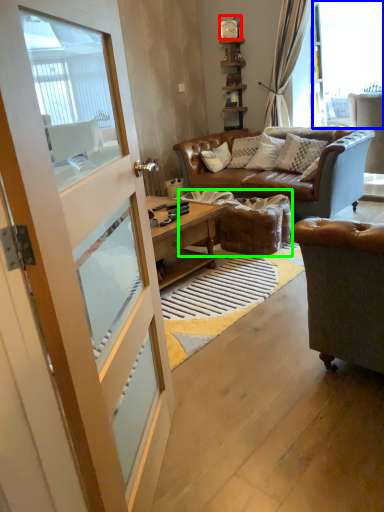
Question: Which object is positioned closest to clock (highlighted by a red box)? Select from window (highlighted by a blue box) and footrest (highlighted by a green box).

Choices:
 (A) window
 (B) footrest

Answer: (A)